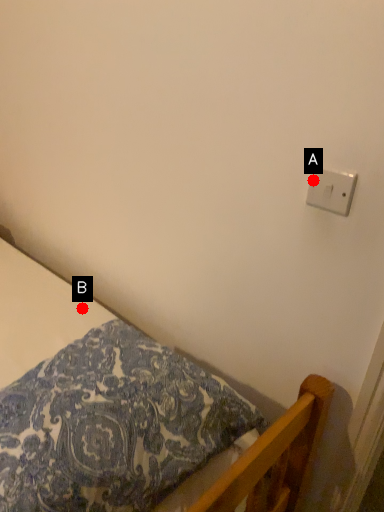
Question: Two points are circled on the image, labeled by A and B beside each circle. Which point appears closest to the camera in this image?

Choices:
 (A) A is closer
 (B) B is closer

Answer: (A)